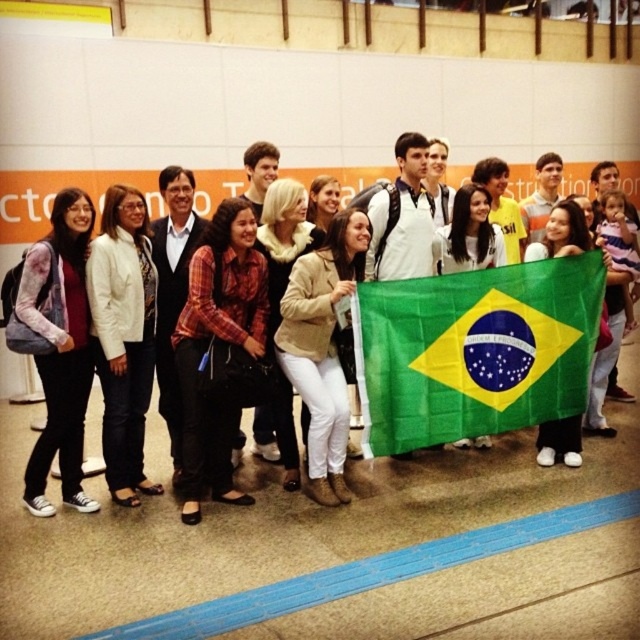
Question: Does green fabric flag at center appear under matte black backpack at lower left?

Choices:
 (A) no
 (B) yes

Answer: (A)

Question: Is green fabric flag at center thinner than matte black backpack at lower left?

Choices:
 (A) no
 (B) yes

Answer: (A)

Question: Is matte black backpack at lower left in front of matte black backpack at center?

Choices:
 (A) no
 (B) yes

Answer: (B)

Question: Which of the following is the closest to the observer?

Choices:
 (A) beige leather jacket at center
 (B) green fabric flag at center
 (C) matte black backpack at center

Answer: (B)

Question: Which point appears closest to the camera in this image?

Choices:
 (A) (538, 314)
 (B) (26, 493)
 (C) (104, 179)

Answer: (B)

Question: Which of the following is the farthest from the observer?

Choices:
 (A) beige leather jacket at center
 (B) matte black backpack at lower left
 (C) matte black backpack at center
 (D) green fabric flag at center

Answer: (C)